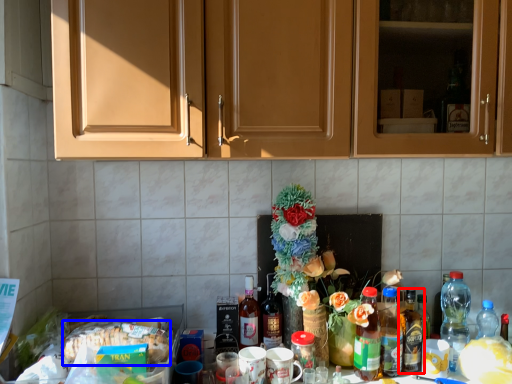
Question: Which point is further to the camera, bottle (highlighted by a red box) or food (highlighted by a blue box)?

Choices:
 (A) bottle
 (B) food

Answer: (A)